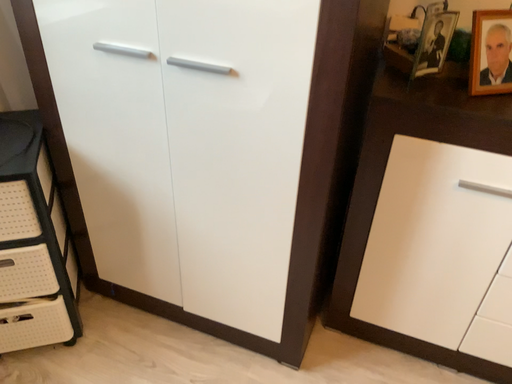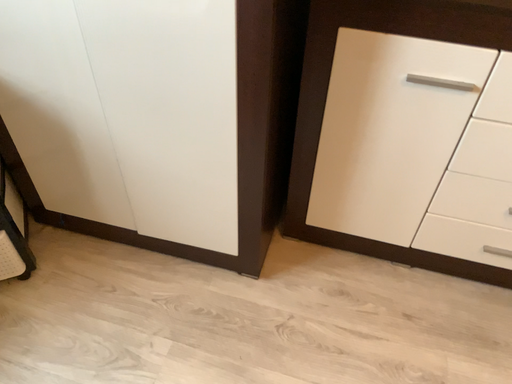
Question: Which way did the camera rotate in the video?

Choices:
 (A) rotated downward
 (B) rotated upward

Answer: (A)